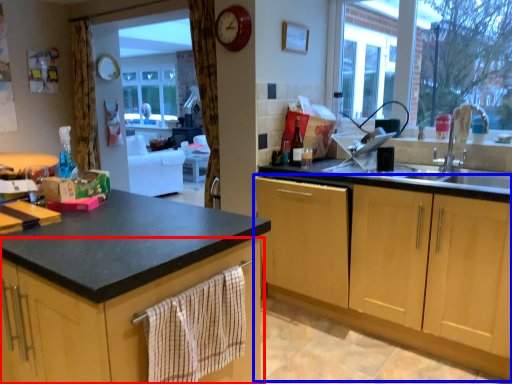
Question: Among these objects, which one is farthest to the camera, cabinetry (highlighted by a red box) or cabinetry (highlighted by a blue box)?

Choices:
 (A) cabinetry
 (B) cabinetry

Answer: (B)